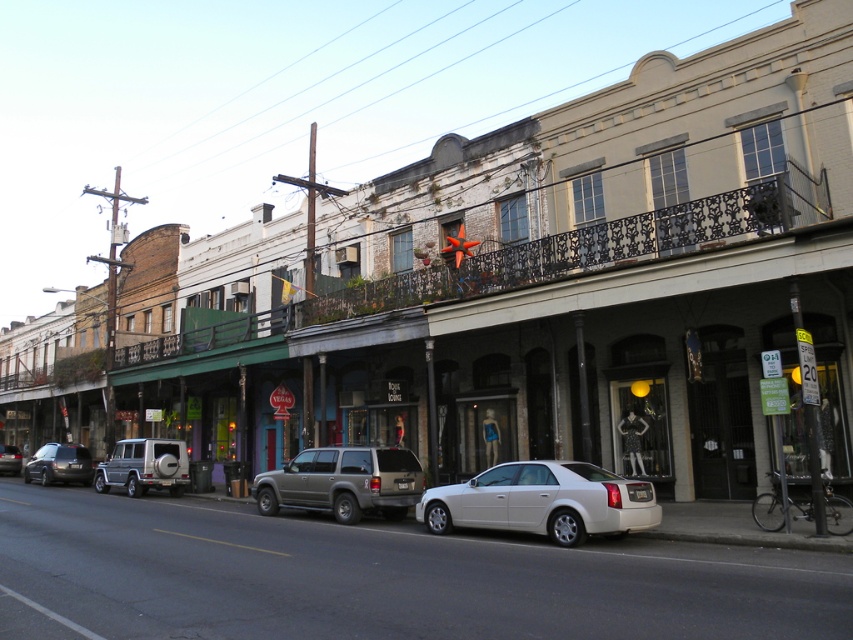
Question: Does silver metallic suv at center-left appear under silver metallic suv at center?

Choices:
 (A) yes
 (B) no

Answer: (B)

Question: Estimate the real-world distances between objects in this image. Which object is farther from the matte black suv at left?

Choices:
 (A) white glossy sedan at center
 (B) silver metallic suv at center-left

Answer: (A)

Question: Does white glossy sedan at center lie behind silver metallic suv at center-left?

Choices:
 (A) yes
 (B) no

Answer: (B)

Question: Which point is closer to the camera taking this photo?

Choices:
 (A) (1, 449)
 (B) (346, 512)
 (C) (138, 486)

Answer: (B)

Question: Does matte gold suv at center have a greater width compared to matte black suv at left?

Choices:
 (A) yes
 (B) no

Answer: (B)

Question: Which object is the farthest from the silver metallic suv at center?

Choices:
 (A) matte gold suv at center
 (B) matte black suv at left
 (C) white glossy sedan at center
 (D) silver metallic suv at center-left

Answer: (C)